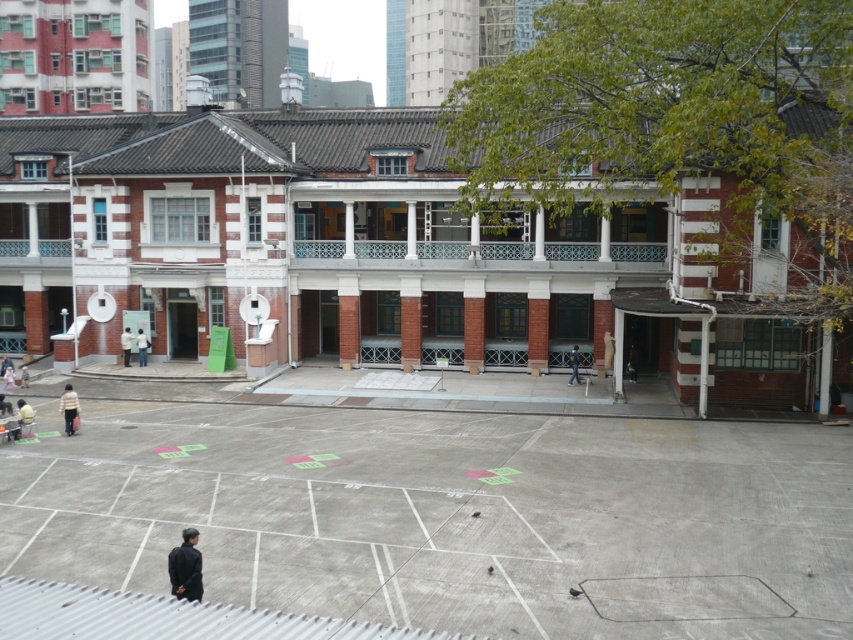
Question: Among these points, which one is nearest to the camera?

Choices:
 (A) (125, 332)
 (B) (573, 352)
 (C) (67, 385)

Answer: (C)

Question: Does light brown wooden door at center left appear on the right side of dark blue jeans at center?

Choices:
 (A) yes
 (B) no

Answer: (B)

Question: Which object is closer to the camera taking this photo?

Choices:
 (A) light brown wooden door at center left
 (B) light beige fabric jacket at lower left
 (C) dark gray fabric jacket at lower left

Answer: (C)

Question: Which is nearer to the striped sweater at lower left?

Choices:
 (A) concrete pavement at center
 (B) light beige fabric jacket at lower left
 (C) light brown wooden door at center left

Answer: (B)

Question: Considering the relative positions of light brown wooden door at center left and light beige fabric jacket at lower left in the image provided, where is light brown wooden door at center left located with respect to light beige fabric jacket at lower left?

Choices:
 (A) below
 (B) above

Answer: (A)

Question: Can you confirm if concrete pavement at center is positioned below striped sweater at lower left?

Choices:
 (A) yes
 (B) no

Answer: (A)